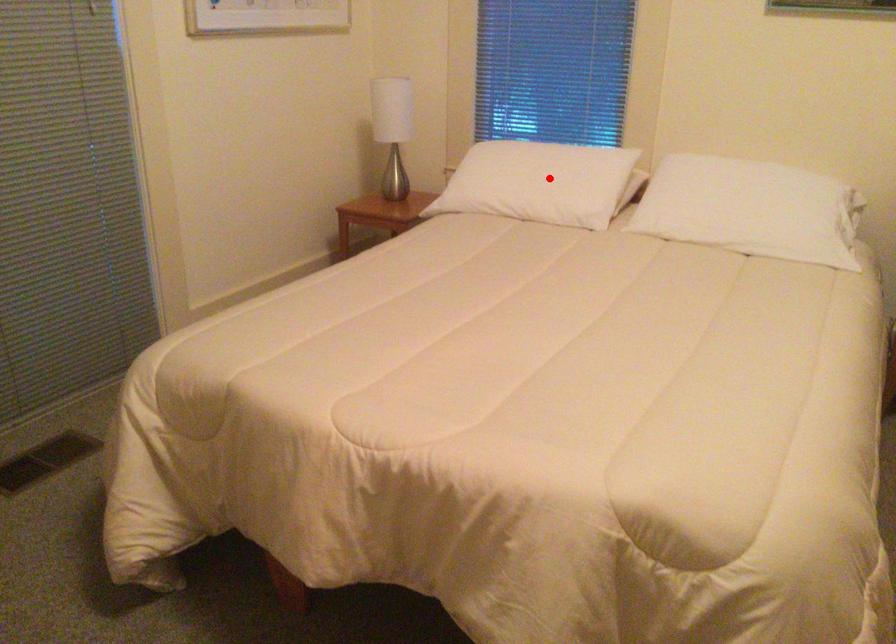
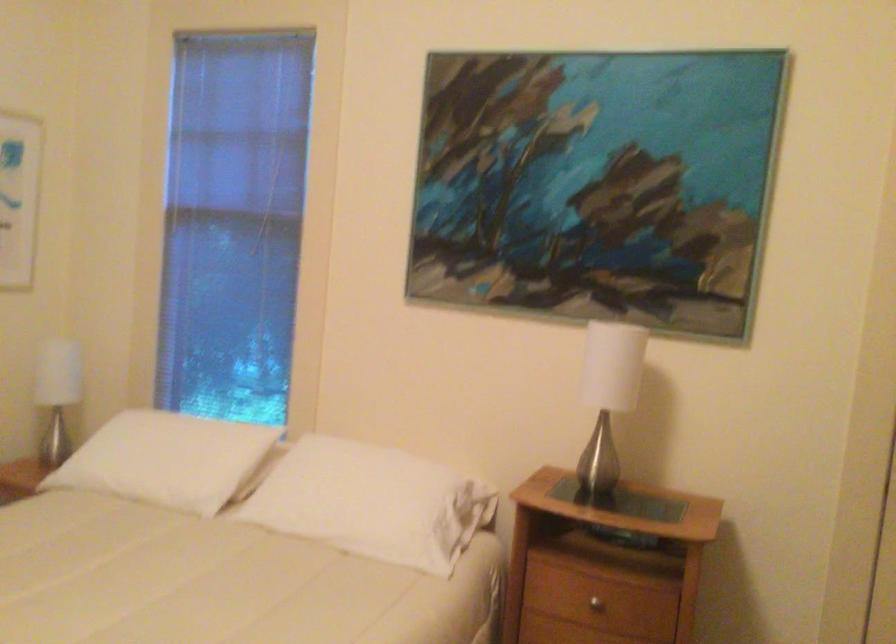
In the second image, find the point that corresponds to the highlighted location in the first image.

(167, 459)